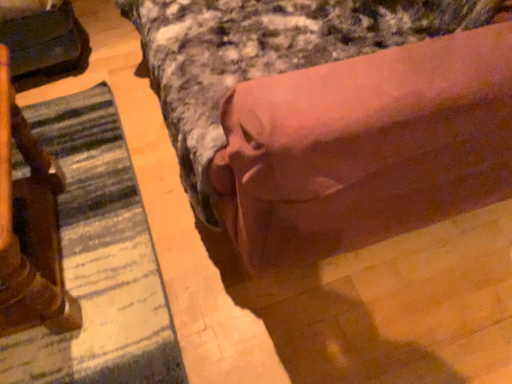
Question: Does matte black swivel chair at left have a greater width compared to striped fabric mat at lower left?

Choices:
 (A) yes
 (B) no

Answer: (B)

Question: From a real-world perspective, is matte black swivel chair at left under striped fabric mat at lower left?

Choices:
 (A) no
 (B) yes

Answer: (A)

Question: Is matte black swivel chair at left outside striped fabric mat at lower left?

Choices:
 (A) no
 (B) yes

Answer: (B)

Question: Is matte black swivel chair at left far from striped fabric mat at lower left?

Choices:
 (A) yes
 (B) no

Answer: (B)

Question: From a real-world perspective, does matte black swivel chair at left stand above striped fabric mat at lower left?

Choices:
 (A) no
 (B) yes

Answer: (B)

Question: Is matte black swivel chair at left bigger than striped fabric mat at lower left?

Choices:
 (A) no
 (B) yes

Answer: (B)

Question: Is striped fabric mat at lower left to the left of brown fabric bed at center from the viewer's perspective?

Choices:
 (A) no
 (B) yes

Answer: (B)

Question: Is the position of striped fabric mat at lower left more distant than that of brown fabric bed at center?

Choices:
 (A) yes
 (B) no

Answer: (A)

Question: Are striped fabric mat at lower left and brown fabric bed at center far apart?

Choices:
 (A) no
 (B) yes

Answer: (A)

Question: Can you confirm if striped fabric mat at lower left is taller than brown fabric bed at center?

Choices:
 (A) yes
 (B) no

Answer: (B)

Question: Is the position of striped fabric mat at lower left less distant than that of brown fabric bed at center?

Choices:
 (A) no
 (B) yes

Answer: (A)

Question: From a real-world perspective, is striped fabric mat at lower left under brown fabric bed at center?

Choices:
 (A) yes
 (B) no

Answer: (A)

Question: Can you confirm if brown fabric bed at center is thinner than matte black swivel chair at left?

Choices:
 (A) no
 (B) yes

Answer: (A)